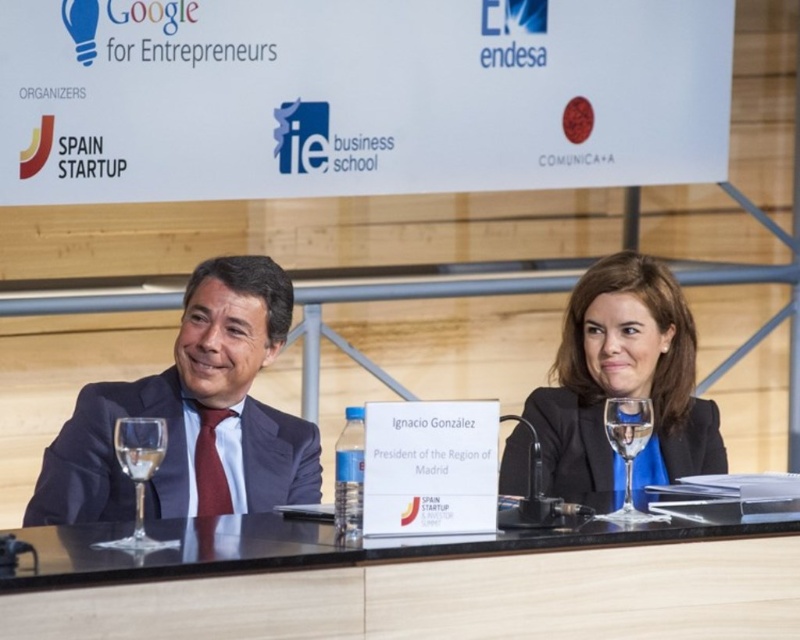
What is located at the coordinates point (416, 580)?

The black glass table at center is located at point (416, 580).

You are a photographer standing behind the black glossy suit at center. You want to take a photo of the black glass table at center. Can you see the table from your current position?

The black glass table at center is below the black glossy suit at center, so yes, the photographer can see the table from behind the suit as it is positioned lower.